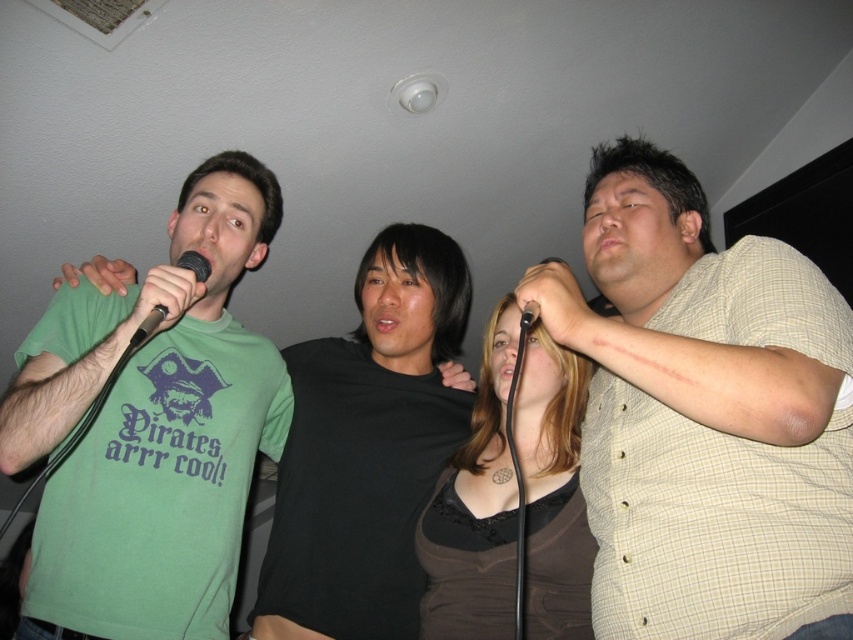
Looking at this image, does light beige checkered shirt at right appear over black matte microphone at left?

No.

Is point (744, 588) farther from camera compared to point (160, 321)?

No, it is in front of (160, 321).

I want to click on light beige checkered shirt at right, so click(704, 413).

Is point (364, 397) behind point (527, 307)?

Yes.

Between point (397, 442) and point (531, 314), which one is positioned in front?

Positioned in front is point (531, 314).

Is point (376, 400) more distant than point (526, 330)?

That is True.

The height and width of the screenshot is (640, 853). What are the coordinates of `black matte shirt at center` in the screenshot? It's located at (367, 448).

Which is more to the left, green matte t-shirt at left or black matte microphone at center?

Positioned to the left is green matte t-shirt at left.

The width and height of the screenshot is (853, 640). I want to click on green matte t-shirt at left, so click(x=151, y=429).

What do you see at coordinates (151, 429) in the screenshot? This screenshot has height=640, width=853. I see `green matte t-shirt at left` at bounding box center [151, 429].

Locate an element on the screen. The height and width of the screenshot is (640, 853). green matte t-shirt at left is located at coordinates (151, 429).